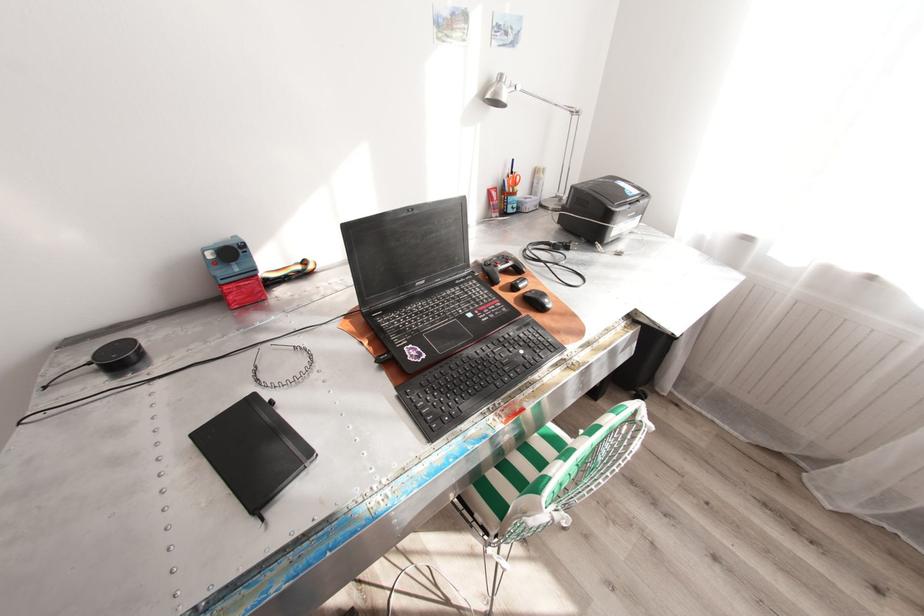
Find the location of a particular element. This screenshot has width=924, height=616. red camera button is located at coordinates (234, 272).